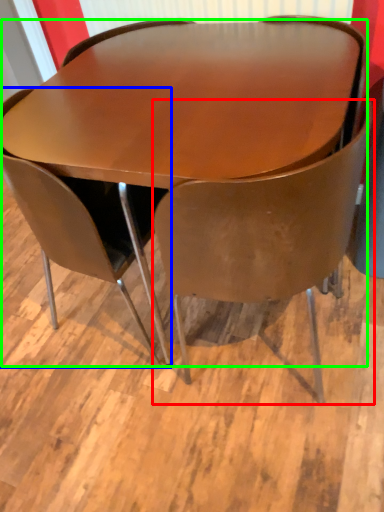
Question: Considering the real-world distances, which object is farthest from chair (highlighted by a red box)? chair (highlighted by a blue box) or table (highlighted by a green box)?

Choices:
 (A) chair
 (B) table

Answer: (A)